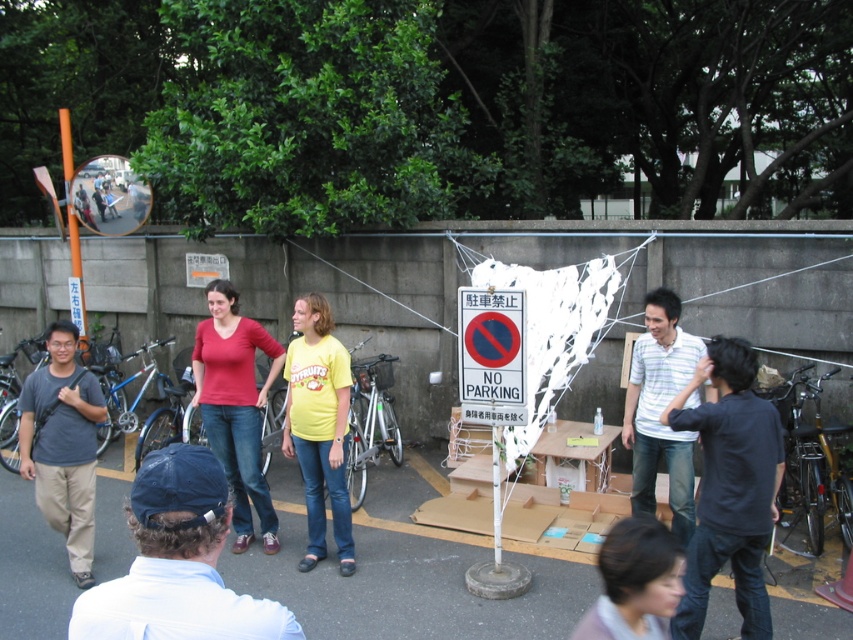
Question: Which point is farther to the camera?

Choices:
 (A) blurred hair at lower center
 (B) white plastic sign at center

Answer: (B)

Question: Does white cotton cap at lower left have a greater width compared to matte gray shirt at left?

Choices:
 (A) yes
 (B) no

Answer: (B)

Question: Is matte red shirt at center thinner than white plastic sign at center?

Choices:
 (A) no
 (B) yes

Answer: (A)

Question: Where is black shirt at right located in relation to yellow cotton shirt at center in the image?

Choices:
 (A) left
 (B) right

Answer: (B)

Question: Among these points, which one is nearest to the camera?

Choices:
 (A) (234, 307)
 (B) (508, 291)
 (C) (636, 486)

Answer: (B)

Question: Which object is the closest to the blurred hair at lower center?

Choices:
 (A) black shirt at right
 (B) white cotton cap at lower left
 (C) matte gray shirt at left
 (D) yellow cotton shirt at center

Answer: (B)